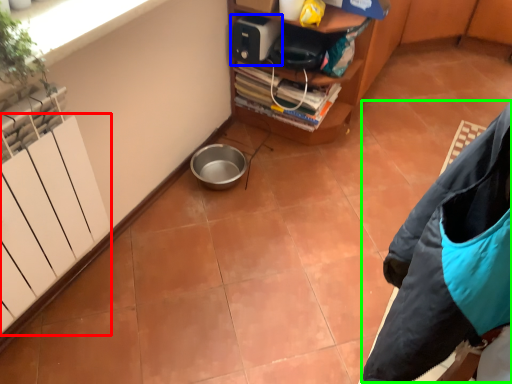
Question: Which object is positioned farthest from radiator (highlighted by a red box)? Select from appliance (highlighted by a blue box) and jacket (highlighted by a green box).

Choices:
 (A) appliance
 (B) jacket

Answer: (A)